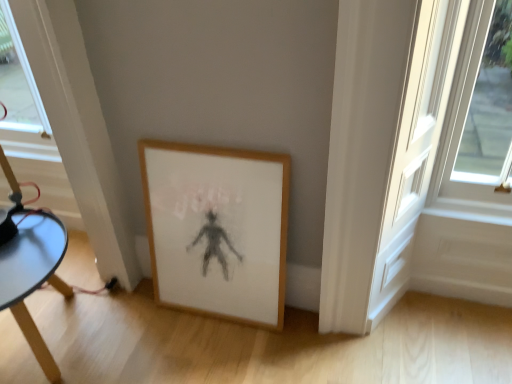
Question: Is the depth of wooden table at lower left greater than that of wooden picture frame at lower center?

Choices:
 (A) yes
 (B) no

Answer: (B)

Question: Considering the relative sizes of wooden table at lower left and wooden picture frame at lower center in the image provided, is wooden table at lower left smaller than wooden picture frame at lower center?

Choices:
 (A) no
 (B) yes

Answer: (A)

Question: Can you confirm if wooden table at lower left is taller than wooden picture frame at lower center?

Choices:
 (A) yes
 (B) no

Answer: (B)

Question: Does wooden table at lower left turn towards wooden picture frame at lower center?

Choices:
 (A) yes
 (B) no

Answer: (B)

Question: Considering the relative sizes of wooden table at lower left and wooden picture frame at lower center in the image provided, is wooden table at lower left wider than wooden picture frame at lower center?

Choices:
 (A) no
 (B) yes

Answer: (B)

Question: Can you confirm if wooden table at lower left is shorter than wooden picture frame at lower center?

Choices:
 (A) yes
 (B) no

Answer: (A)

Question: Is wooden picture frame at lower center taller than wooden table at lower left?

Choices:
 (A) no
 (B) yes

Answer: (B)

Question: Could wooden table at lower left be considered to be inside wooden picture frame at lower center?

Choices:
 (A) no
 (B) yes

Answer: (A)

Question: Is wooden picture frame at lower center shorter than wooden table at lower left?

Choices:
 (A) no
 (B) yes

Answer: (A)

Question: Considering the relative sizes of wooden picture frame at lower center and wooden table at lower left in the image provided, is wooden picture frame at lower center bigger than wooden table at lower left?

Choices:
 (A) no
 (B) yes

Answer: (A)

Question: Would you say wooden picture frame at lower center is a long distance from wooden table at lower left?

Choices:
 (A) no
 (B) yes

Answer: (A)

Question: From the image's perspective, does wooden picture frame at lower center appear lower than wooden table at lower left?

Choices:
 (A) no
 (B) yes

Answer: (A)

Question: Considering their positions, is wooden table at lower left located in front of or behind wooden picture frame at lower center?

Choices:
 (A) front
 (B) behind

Answer: (A)